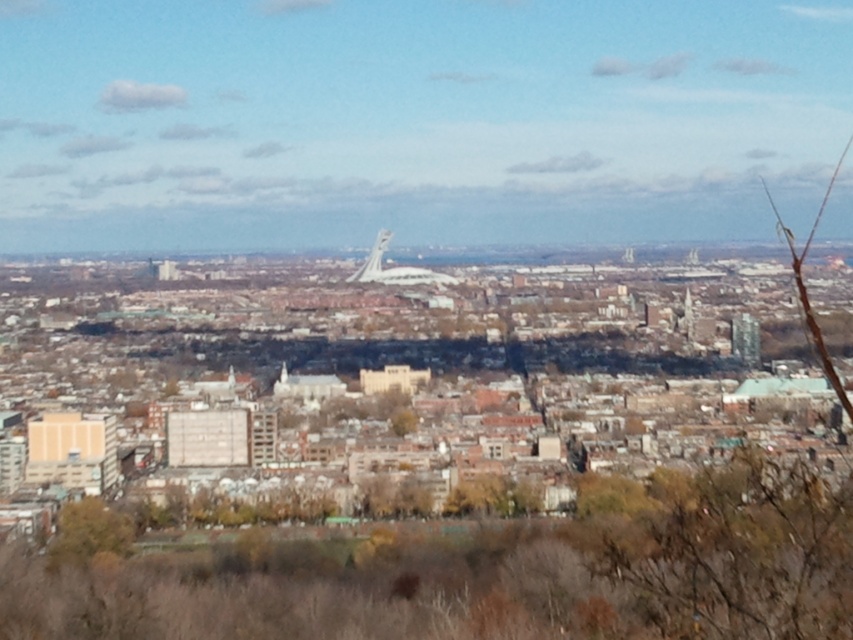
Is brown leafy tree at center shorter than shiny metallic tower at center?

In fact, brown leafy tree at center may be taller than shiny metallic tower at center.

Does brown leafy tree at center have a larger size compared to shiny metallic tower at center?

Yes.

Describe the element at coordinates (486, 573) in the screenshot. I see `brown leafy tree at center` at that location.

Where is `brown leafy tree at center`? This screenshot has height=640, width=853. brown leafy tree at center is located at coordinates (486, 573).

Between brown leafy tree at center and green leafy tree at lower left, which one appears on the left side from the viewer's perspective?

green leafy tree at lower left is more to the left.

How much distance is there between brown leafy tree at center and green leafy tree at lower left?

brown leafy tree at center and green leafy tree at lower left are 100.79 meters apart.

Describe the element at coordinates (486, 573) in the screenshot. Image resolution: width=853 pixels, height=640 pixels. I see `brown leafy tree at center` at that location.

This screenshot has width=853, height=640. In order to click on brown leafy tree at center in this screenshot , I will do `click(486, 573)`.

Between green leafy tree at lower left and shiny metallic tower at center, which one appears on the right side from the viewer's perspective?

shiny metallic tower at center

Who is taller, green leafy tree at lower left or shiny metallic tower at center?

With more height is green leafy tree at lower left.

Locate an element on the screen. This screenshot has height=640, width=853. green leafy tree at lower left is located at coordinates (88, 531).

Image resolution: width=853 pixels, height=640 pixels. I want to click on green leafy tree at lower left, so click(x=88, y=531).